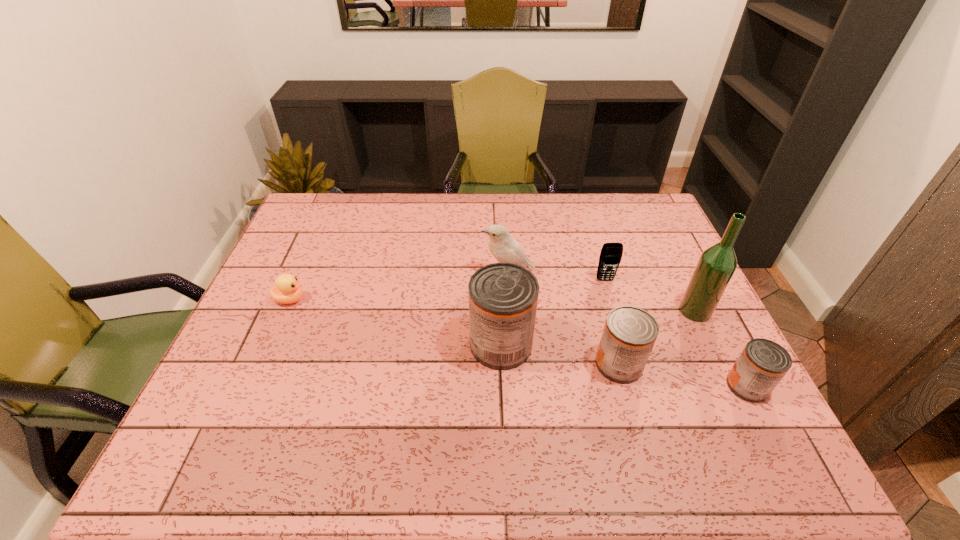
Please point a vacant point for placing a can on the left. Please provide its 2D coordinates. Your answer should be formatted as a tuple, i.e. [(x, y)], where the tuple contains the x and y coordinates of a point satisfying the conditions above.

[(392, 326)]